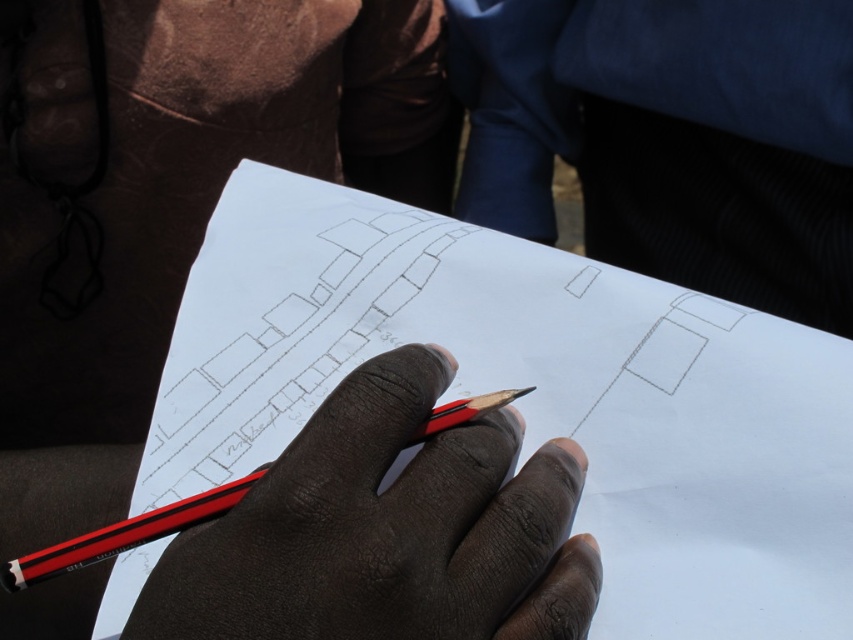
Can you confirm if white paper at center is positioned to the right of black matte pencil at center?

Yes, white paper at center is to the right of black matte pencil at center.

Is white paper at center below black matte pencil at center?

No.

This screenshot has width=853, height=640. Find the location of `white paper at center`. white paper at center is located at coordinates (532, 396).